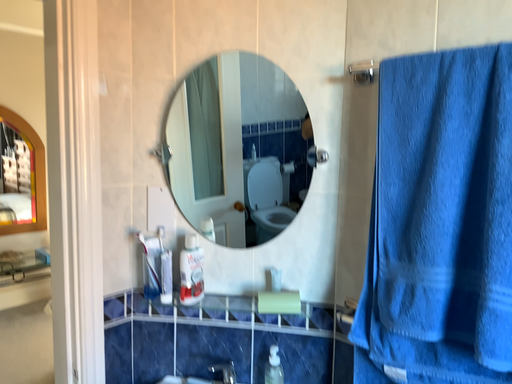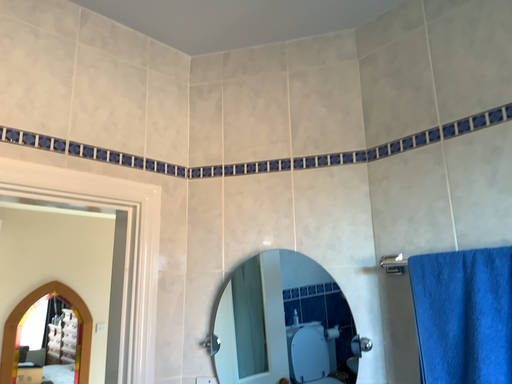
Question: Which way did the camera rotate in the video?

Choices:
 (A) rotated upward
 (B) rotated downward

Answer: (A)